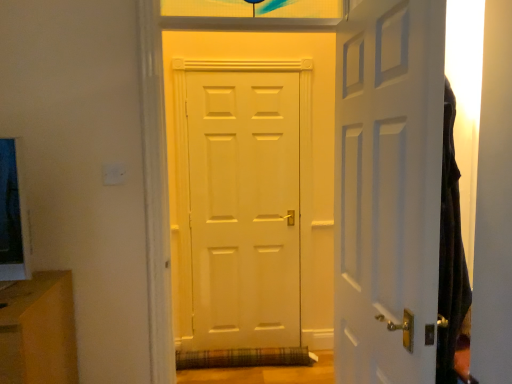
Image resolution: width=512 pixels, height=384 pixels. What do you see at coordinates (251, 188) in the screenshot?
I see `white matte door at center, which is the 2th door from right to left` at bounding box center [251, 188].

Where is `white matte door at center, which is counted as the first door, starting from the left`? The width and height of the screenshot is (512, 384). white matte door at center, which is counted as the first door, starting from the left is located at coordinates (251, 188).

Image resolution: width=512 pixels, height=384 pixels. Describe the element at coordinates (388, 189) in the screenshot. I see `white matte door at right, the second door in the left-to-right sequence` at that location.

Find the location of a particular element. white matte door at right, the second door in the left-to-right sequence is located at coordinates (388, 189).

This screenshot has width=512, height=384. Find the location of `white matte door at center, which is the 2th door from right to left`. white matte door at center, which is the 2th door from right to left is located at coordinates (251, 188).

Visually, is white matte door at center, which is counted as the first door, starting from the left, positioned to the left or to the right of white matte door at right, the second door in the left-to-right sequence?

Clearly, white matte door at center, which is counted as the first door, starting from the left, is on the left of white matte door at right, the second door in the left-to-right sequence, in the image.

In the image, is white matte door at center, which is the 2th door from right to left, positioned in front of or behind white matte door at right, the second door in the left-to-right sequence?

Clearly, white matte door at center, which is the 2th door from right to left, is behind white matte door at right, the second door in the left-to-right sequence.

From the picture: Which is closer to the camera, (249, 107) or (408, 261)?

The point (408, 261) is closer.

From the image's perspective, is white matte door at center, which is counted as the first door, starting from the left, located beneath white matte door at right, arranged as the 1th door when viewed from the right?

No.

From a real-world perspective, between white matte door at center, which is the 2th door from right to left, and white matte door at right, the second door in the left-to-right sequence, who is vertically lower?

From a 3D spatial view, white matte door at right, the second door in the left-to-right sequence, is below.

Which object is wider, white matte door at center, which is the 2th door from right to left, or white matte door at right, arranged as the 1th door when viewed from the right?

white matte door at center, which is the 2th door from right to left.

Who is taller, white matte door at center, which is the 2th door from right to left, or white matte door at right, the second door in the left-to-right sequence?

white matte door at center, which is the 2th door from right to left.

Can you confirm if white matte door at center, which is the 2th door from right to left, is smaller than white matte door at right, the second door in the left-to-right sequence?

No.

Is white matte door at center, which is counted as the first door, starting from the left, completely or partially outside of white matte door at right, the second door in the left-to-right sequence?

Indeed, white matte door at center, which is counted as the first door, starting from the left, is completely outside white matte door at right, the second door in the left-to-right sequence.

Is white matte door at center, which is the 2th door from right to left, positioned far away from white matte door at right, the second door in the left-to-right sequence?

That's right, there is a large distance between white matte door at center, which is the 2th door from right to left, and white matte door at right, the second door in the left-to-right sequence.

Is white matte door at center, which is counted as the first door, starting from the left, facing away from white matte door at right, the second door in the left-to-right sequence?

That's not correct — white matte door at center, which is counted as the first door, starting from the left, is not looking away from white matte door at right, the second door in the left-to-right sequence.

How different are the orientations of white matte door at center, which is counted as the first door, starting from the left, and white matte door at right, arranged as the 1th door when viewed from the right, in degrees?

There is a 88.6-degree angle between the facing directions of white matte door at center, which is counted as the first door, starting from the left, and white matte door at right, arranged as the 1th door when viewed from the right.

Identify the location of door to the left of white matte door at right, the second door in the left-to-right sequence. (251, 188).

Considering the positions of objects white matte door at right, the second door in the left-to-right sequence, and white matte door at center, which is the 2th door from right to left, in the image provided, who is more to the left, white matte door at right, the second door in the left-to-right sequence, or white matte door at center, which is the 2th door from right to left,?

white matte door at center, which is the 2th door from right to left, is more to the left.

Considering their positions, is white matte door at right, arranged as the 1th door when viewed from the right, located in front of or behind white matte door at center, which is the 2th door from right to left?

Visually, white matte door at right, arranged as the 1th door when viewed from the right, is located in front of white matte door at center, which is the 2th door from right to left.

Does point (421, 342) appear closer or farther from the camera than point (275, 95)?

Point (421, 342) appears to be closer to the viewer than point (275, 95).

From the image's perspective, is white matte door at right, the second door in the left-to-right sequence, above white matte door at center, which is counted as the first door, starting from the left?

No, from the image's perspective, white matte door at right, the second door in the left-to-right sequence, is not on top of white matte door at center, which is counted as the first door, starting from the left.

From a real-world perspective, which object rests below the other?

From a 3D spatial view, white matte door at right, arranged as the 1th door when viewed from the right, is below.

Does white matte door at right, arranged as the 1th door when viewed from the right, have a greater width compared to white matte door at center, which is the 2th door from right to left?

No, white matte door at right, arranged as the 1th door when viewed from the right, is not wider than white matte door at center, which is the 2th door from right to left.

Is white matte door at right, the second door in the left-to-right sequence, shorter than white matte door at center, which is the 2th door from right to left?

Yes.

Is white matte door at right, arranged as the 1th door when viewed from the right, smaller than white matte door at center, which is the 2th door from right to left?

Yes.

Would you say white matte door at right, the second door in the left-to-right sequence, contains white matte door at center, which is counted as the first door, starting from the left?

No, white matte door at center, which is counted as the first door, starting from the left, is not a part of white matte door at right, the second door in the left-to-right sequence.

Is white matte door at right, arranged as the 1th door when viewed from the right, next to white matte door at center, which is the 2th door from right to left, and touching it?

No, white matte door at right, arranged as the 1th door when viewed from the right, is not next to white matte door at center, which is the 2th door from right to left.

Is white matte door at right, the second door in the left-to-right sequence, facing towards white matte door at center, which is the 2th door from right to left?

Yes.

At what (x,y) coordinates should I click in order to perform the action: click on door lying on the left of white matte door at right, arranged as the 1th door when viewed from the right. Please return your answer as a coordinate pair (x, y). This screenshot has height=384, width=512. Looking at the image, I should click on (251, 188).

In order to click on door located underneath the white matte door at center, which is the 2th door from right to left (from a real-world perspective) in this screenshot , I will do `click(388, 189)`.

Locate an element on the screen. The height and width of the screenshot is (384, 512). door lying in front of the white matte door at center, which is the 2th door from right to left is located at coordinates (388, 189).